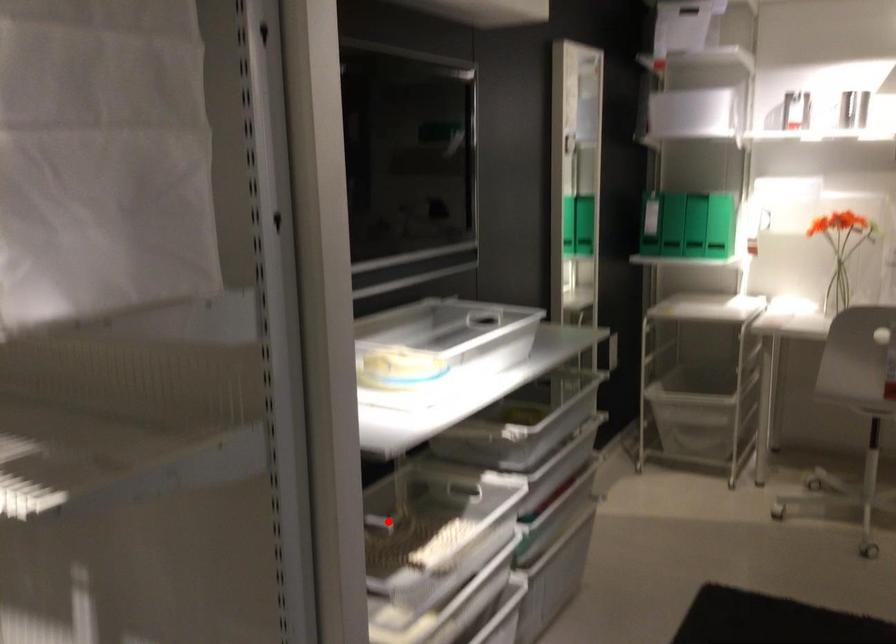
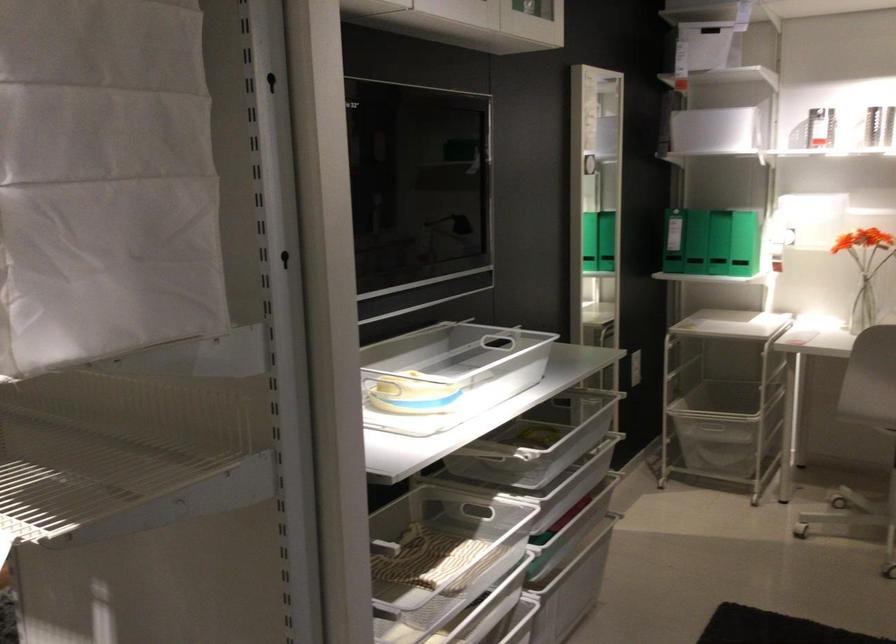
In the second image, find the point that corresponds to the highlighted location in the first image.

(393, 545)